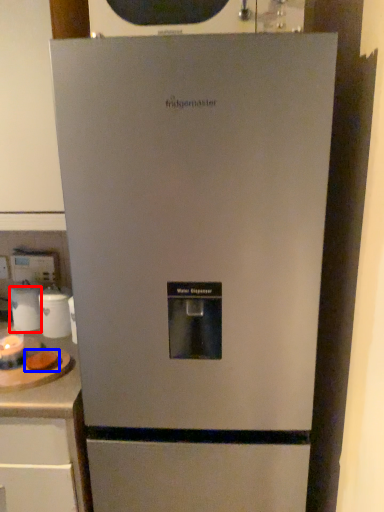
Question: Which object is closer to the camera taking this photo, appliance (highlighted by a red box) or food (highlighted by a blue box)?

Choices:
 (A) appliance
 (B) food

Answer: (B)